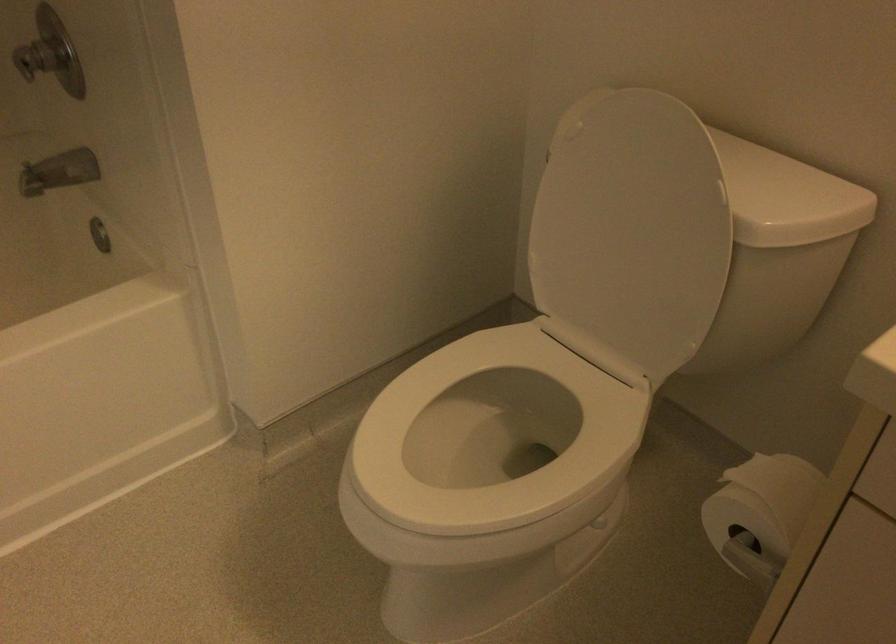
The image size is (896, 644). I want to click on white toilet lid, so click(x=631, y=232).